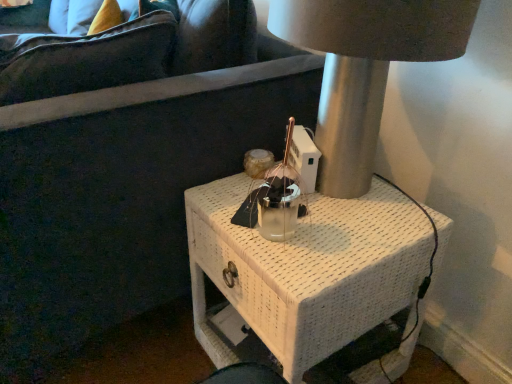
Question: Is metallic silver lamp at center bigger than white woven nightstand at center?

Choices:
 (A) no
 (B) yes

Answer: (A)

Question: Can you confirm if metallic silver lamp at center is positioned to the left of white woven nightstand at center?

Choices:
 (A) yes
 (B) no

Answer: (B)

Question: From a real-world perspective, is metallic silver lamp at center under white woven nightstand at center?

Choices:
 (A) yes
 (B) no

Answer: (B)

Question: Can you confirm if metallic silver lamp at center is taller than white woven nightstand at center?

Choices:
 (A) yes
 (B) no

Answer: (B)

Question: From the image's perspective, is metallic silver lamp at center over white woven nightstand at center?

Choices:
 (A) yes
 (B) no

Answer: (A)

Question: Would you consider metallic silver lamp at center to be distant from white woven nightstand at center?

Choices:
 (A) no
 (B) yes

Answer: (A)

Question: Can we say white woven nightstand at center lies outside metallic silver lamp at center?

Choices:
 (A) no
 (B) yes

Answer: (B)

Question: Would you say white woven nightstand at center contains metallic silver lamp at center?

Choices:
 (A) no
 (B) yes

Answer: (A)

Question: Considering the relative sizes of white woven nightstand at center and metallic silver lamp at center in the image provided, is white woven nightstand at center wider than metallic silver lamp at center?

Choices:
 (A) yes
 (B) no

Answer: (A)

Question: From the image's perspective, is white woven nightstand at center under metallic silver lamp at center?

Choices:
 (A) yes
 (B) no

Answer: (A)

Question: Does white woven nightstand at center lie behind metallic silver lamp at center?

Choices:
 (A) yes
 (B) no

Answer: (A)

Question: Is white woven nightstand at center directly adjacent to metallic silver lamp at center?

Choices:
 (A) yes
 (B) no

Answer: (B)

Question: From a real-world perspective, is white woven nightstand at center above or below metallic silver lamp at center?

Choices:
 (A) above
 (B) below

Answer: (B)